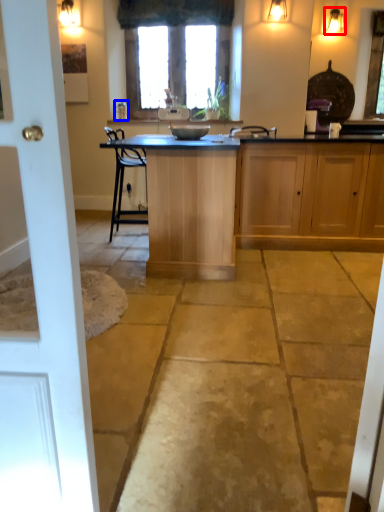
Question: Which object appears closest to the camera in this image, light fixture (highlighted by a red box) or faucet (highlighted by a blue box)?

Choices:
 (A) light fixture
 (B) faucet

Answer: (A)